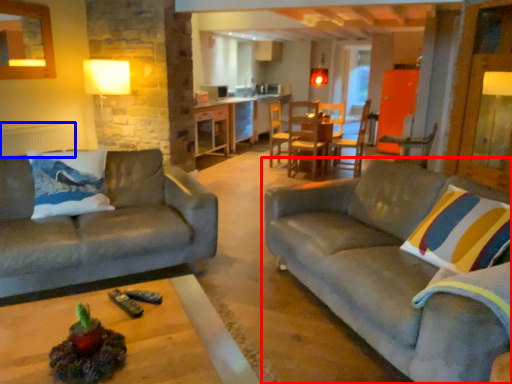
Question: Which object is further to the camera taking this photo, studio couch (highlighted by a red box) or radiator (highlighted by a blue box)?

Choices:
 (A) studio couch
 (B) radiator

Answer: (B)